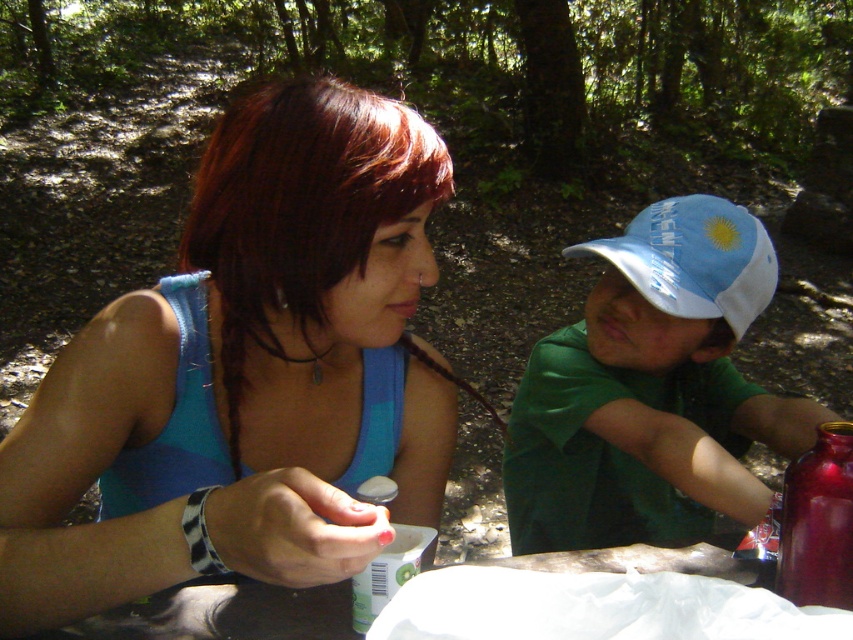
Question: Which object is the closest to the shiny metallic bottle at right?

Choices:
 (A) matte blue tank top at center
 (B) blue fabric baseball cap at upper right
 (C) white mesh cap at right

Answer: (C)

Question: Which of these objects is positioned closest to the matte blue tank top at center?

Choices:
 (A) white mesh cap at right
 (B) shiny metallic bottle at right
 (C) blue fabric baseball cap at upper right

Answer: (A)

Question: Which point is closer to the camera?

Choices:
 (A) (822, 584)
 (B) (630, 275)

Answer: (A)

Question: Is matte blue tank top at center thinner than white mesh cap at right?

Choices:
 (A) no
 (B) yes

Answer: (A)

Question: In this image, where is matte blue tank top at center located relative to blue fabric baseball cap at upper right?

Choices:
 (A) right
 (B) left

Answer: (B)

Question: Can you confirm if matte blue tank top at center is wider than blue fabric baseball cap at upper right?

Choices:
 (A) no
 (B) yes

Answer: (B)